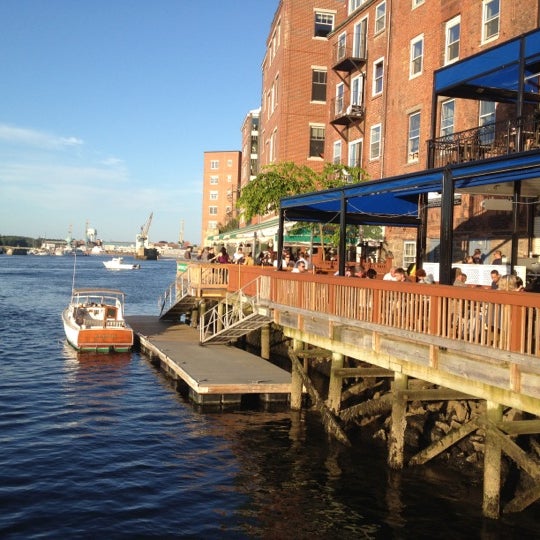
The width and height of the screenshot is (540, 540). I want to click on windows upper right side, so click(414, 125), click(448, 119), click(483, 103), click(378, 89), click(375, 140), click(355, 96).